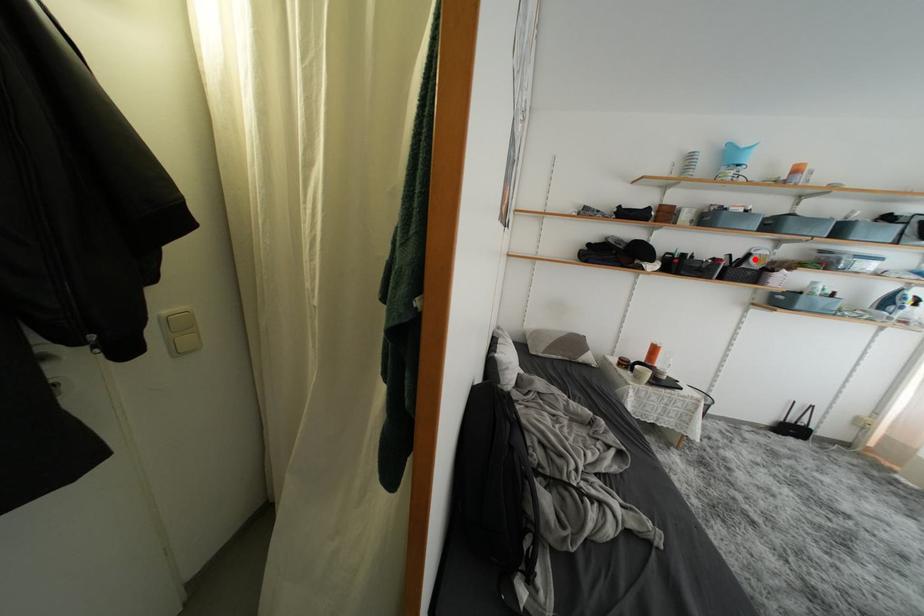
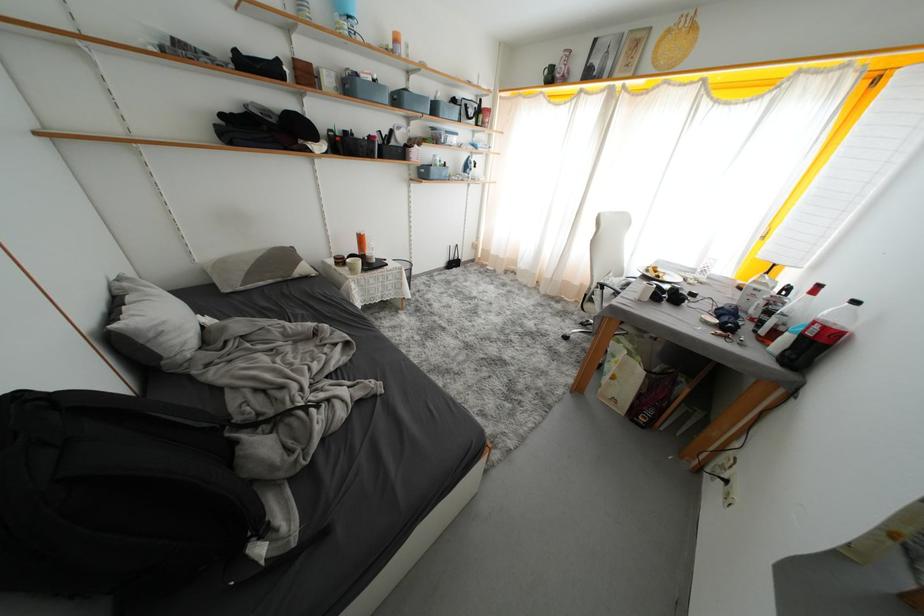
Where in the second image is the point corresponding to the highlighted location from the first image?

(397, 136)